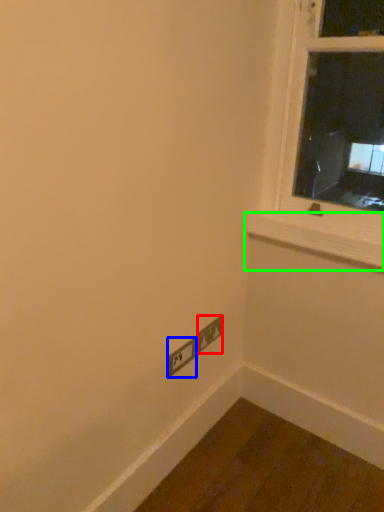
Question: Based on their relative distances, which object is farther from power plugs and sockets (highlighted by a red box)? Choose from power plugs and sockets (highlighted by a blue box) and window sill (highlighted by a green box).

Choices:
 (A) power plugs and sockets
 (B) window sill

Answer: (B)